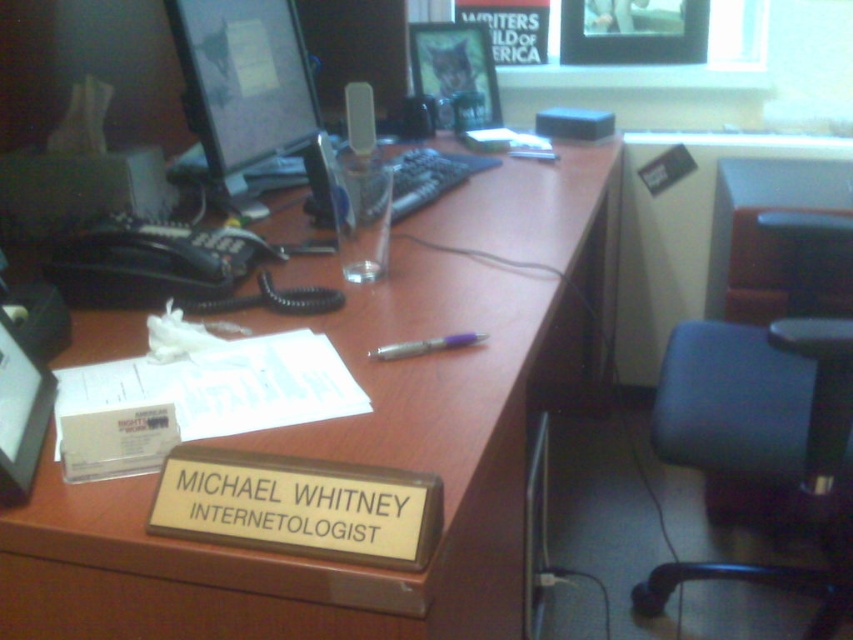
You are an office worker who needs to retrieve a file from the brown wood desk at center. However, you must first open the brown wood drawer at lower center to get a key. Can you reach the drawer without moving the desk?

Yes, because the brown wood desk at center is in front of the brown wood drawer at lower center, meaning the drawer is behind the desk and accessible from the front side where you are standing.

You are organizing a desk space and need to place a new item that requires 20 square inches of space. Given the brown wood desk at center and the matte black monitor at upper left, which object can accommodate the new item based on their sizes?

The brown wood desk at center has a larger size compared to the matte black monitor at upper left, so it can accommodate the new item requiring 20 square inches of space.

You are an office worker who needs to move a heavy box from the brown wood desk at center to the matte black monitor at upper left. Considering their positions, which object will you have to move first to create space?

The brown wood desk at center is in front of the matte black monitor at upper left, so you would need to move items off the brown wood desk at center first to create space before moving the box to the matte black monitor at upper left.